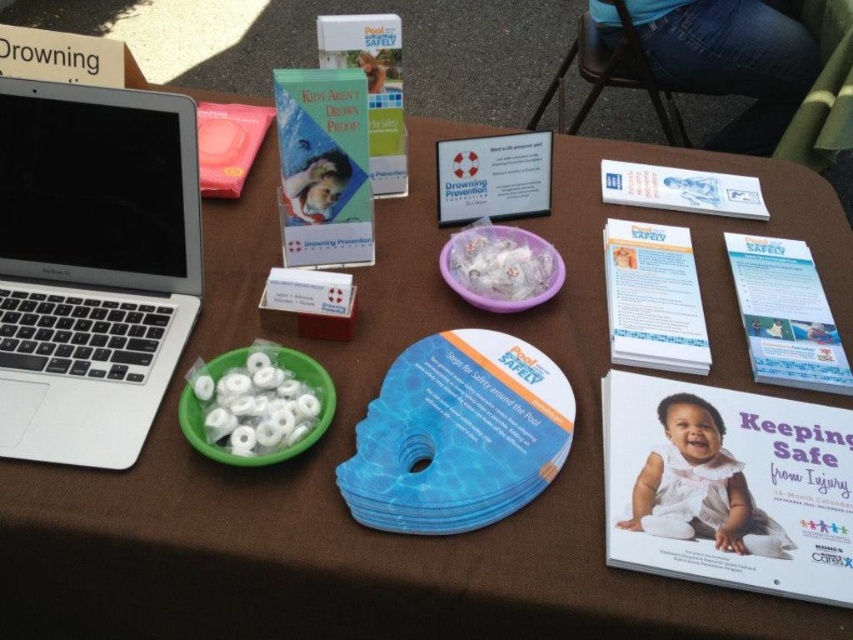
Question: Which of the following is the closest to the observer?

Choices:
 (A) white matte baby at center
 (B) silver/black plastic laptop at left
 (C) jeans at upper right

Answer: (A)

Question: Which object is positioned closest to the white matte baby at center?

Choices:
 (A) jeans at upper right
 (B) silver/black plastic laptop at left

Answer: (B)

Question: Can you confirm if jeans at upper right is wider than white matte baby at center?

Choices:
 (A) yes
 (B) no

Answer: (A)

Question: Among these points, which one is nearest to the camera?

Choices:
 (A) (763, 68)
 (B) (6, 216)
 (C) (676, 516)

Answer: (C)

Question: Is jeans at upper right below white matte baby at center?

Choices:
 (A) yes
 (B) no

Answer: (B)

Question: Is silver/black plastic laptop at left thinner than jeans at upper right?

Choices:
 (A) no
 (B) yes

Answer: (B)